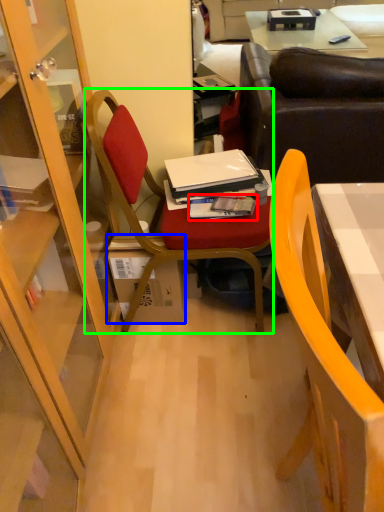
Question: Considering the real-world distances, which object is farthest from magazine (highlighted by a red box)? box (highlighted by a blue box) or chair (highlighted by a green box)?

Choices:
 (A) box
 (B) chair

Answer: (A)